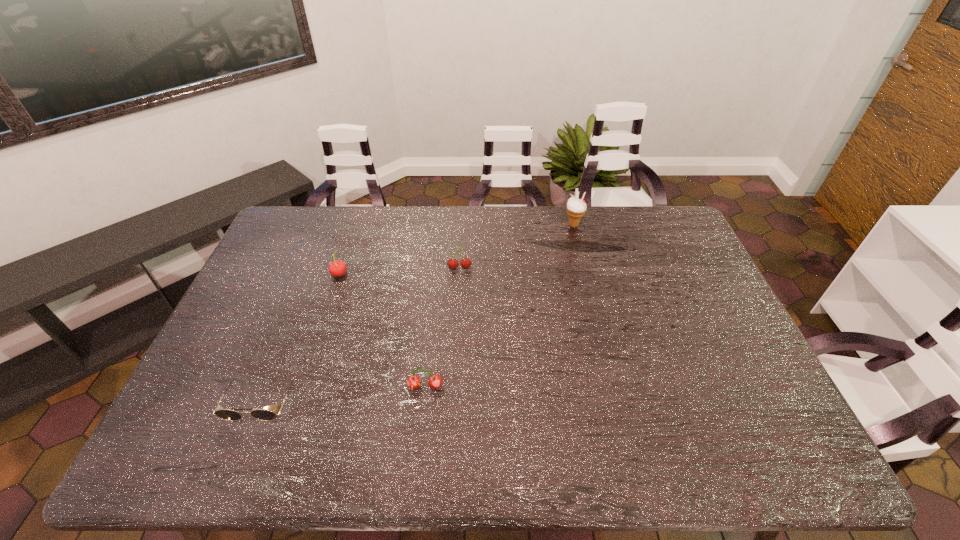
Locate an element on the screen. This screenshot has width=960, height=540. free space between the farthest object and the sunglasses is located at coordinates (419, 313).

Identify the location of free spot between the icecream and the sunglasses. (419, 313).

At what (x,y) coordinates should I click in order to perform the action: click on object that is the fourth closest to the leftmost cherry. Please return your answer as a coordinate pair (x, y). Looking at the image, I should click on (576, 208).

Locate which object is the third closest to the rightmost object. Please provide its 2D coordinates. Your answer should be formatted as a tuple, i.e. [(x, y)], where the tuple contains the x and y coordinates of a point satisfying the conditions above.

[(337, 268)]

Where is `cherry that stands as the closest to the nearest cherry`? This screenshot has width=960, height=540. cherry that stands as the closest to the nearest cherry is located at coordinates (465, 262).

Locate an element on the screen. The image size is (960, 540). cherry object that ranks as the closest to the leftmost cherry is located at coordinates (465, 262).

Locate an element on the screen. This screenshot has width=960, height=540. vacant space that satisfies the following two spatial constraints: 1. on the back side of the icecream; 2. on the left side of the leftmost cherry is located at coordinates (355, 225).